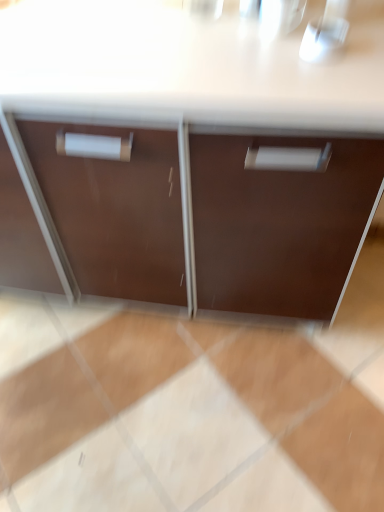
Image resolution: width=384 pixels, height=512 pixels. I want to click on empty space that is ontop of matte brown tile at center, so click(x=200, y=384).